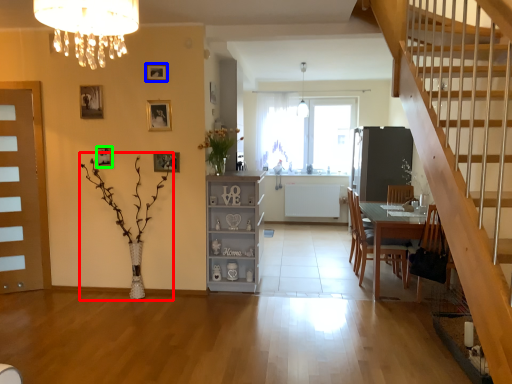
Question: Which object is positioned farthest from plant (highlighted by a red box)? Select from picture frame (highlighted by a blue box) and picture frame (highlighted by a green box).

Choices:
 (A) picture frame
 (B) picture frame

Answer: (A)